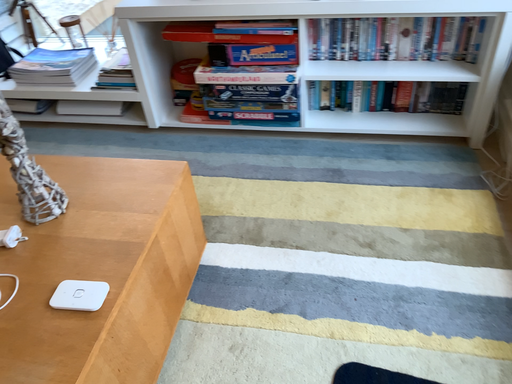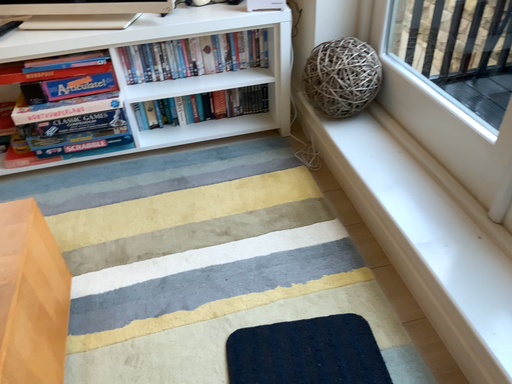
Question: How did the camera likely rotate when shooting the video?

Choices:
 (A) rotated left
 (B) rotated right

Answer: (B)